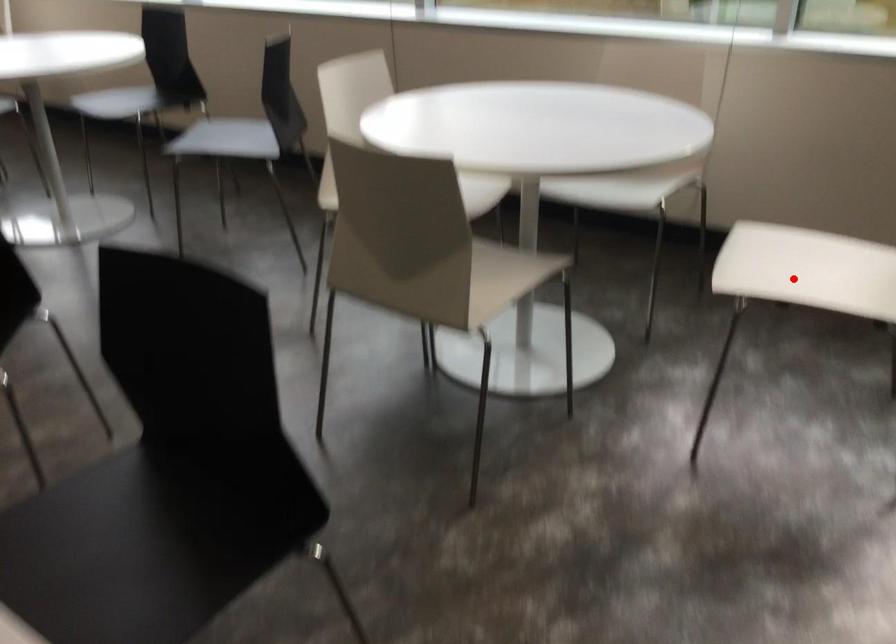
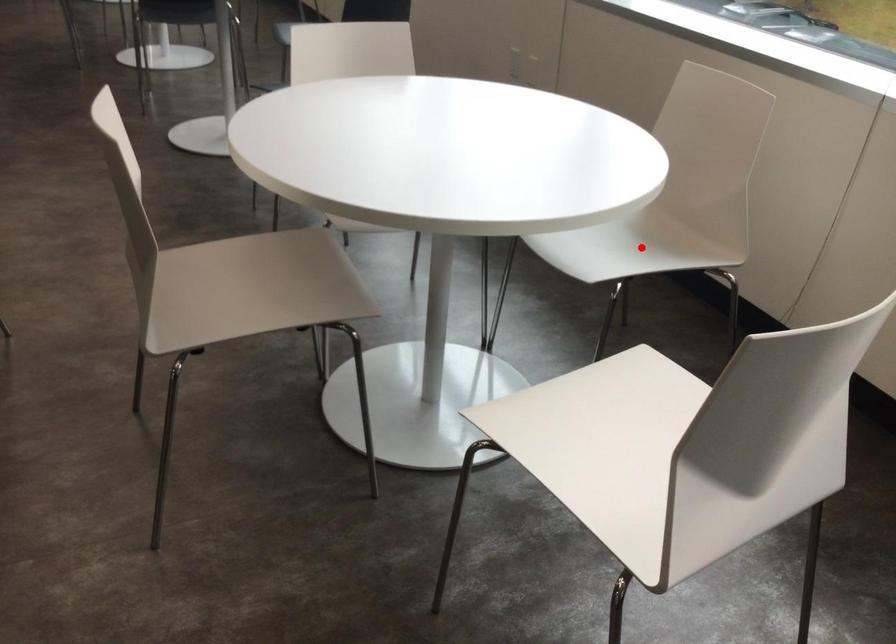
I am providing you with two images of the same scene from different viewpoints. A red point is marked on the first image and another point is marked on the second image. Is the red point in image1 aligned with the point shown in image2?

No